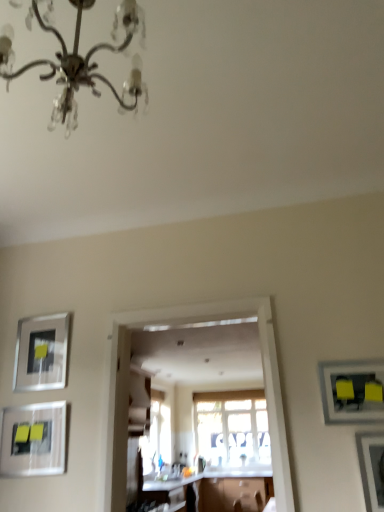
Question: Could you tell me if metallic silver picture frame at lower right, which is counted as the 4th picture frame, starting from the back, is facing transparent glass door at center?

Choices:
 (A) no
 (B) yes

Answer: (A)

Question: Considering the relative sizes of metallic silver picture frame at lower right, acting as the first picture frame starting from the front, and transparent glass door at center in the image provided, is metallic silver picture frame at lower right, acting as the first picture frame starting from the front, thinner than transparent glass door at center?

Choices:
 (A) no
 (B) yes

Answer: (B)

Question: Are metallic silver picture frame at lower right, which ranks as the 4th picture frame in left-to-right order, and transparent glass door at center located far from each other?

Choices:
 (A) yes
 (B) no

Answer: (B)

Question: Is metallic silver picture frame at lower right, acting as the first picture frame starting from the front, at the left side of transparent glass door at center?

Choices:
 (A) yes
 (B) no

Answer: (B)

Question: Is the depth of metallic silver picture frame at lower right, which ranks as the 4th picture frame in left-to-right order, greater than that of transparent glass door at center?

Choices:
 (A) no
 (B) yes

Answer: (A)

Question: Is metallic silver picture frame at lower right, which is counted as the 4th picture frame, starting from the back, bigger than transparent glass door at center?

Choices:
 (A) yes
 (B) no

Answer: (B)

Question: Considering the relative sizes of metallic silver picture frame at lower right, which ranks as the 4th picture frame in left-to-right order, and silver metallic picture frame at left, the first picture frame positioned from the left, in the image provided, is metallic silver picture frame at lower right, which ranks as the 4th picture frame in left-to-right order, smaller than silver metallic picture frame at left, the first picture frame positioned from the left,?

Choices:
 (A) yes
 (B) no

Answer: (A)

Question: Does metallic silver picture frame at lower right, which is counted as the 4th picture frame, starting from the back, turn towards silver metallic picture frame at left, acting as the fourth picture frame starting from the right?

Choices:
 (A) no
 (B) yes

Answer: (A)

Question: Considering the relative sizes of metallic silver picture frame at lower right, which ranks as the 4th picture frame in left-to-right order, and silver metallic picture frame at left, the first picture frame positioned from the left, in the image provided, is metallic silver picture frame at lower right, which ranks as the 4th picture frame in left-to-right order, shorter than silver metallic picture frame at left, the first picture frame positioned from the left,?

Choices:
 (A) no
 (B) yes

Answer: (B)

Question: Is metallic silver picture frame at lower right, acting as the first picture frame starting from the front, not close to silver metallic picture frame at left, the 1th picture frame viewed from the back?

Choices:
 (A) yes
 (B) no

Answer: (A)

Question: Is the position of metallic silver picture frame at lower right, acting as the first picture frame starting from the front, more distant than that of silver metallic picture frame at left, acting as the fourth picture frame starting from the right?

Choices:
 (A) yes
 (B) no

Answer: (B)

Question: Is metallic silver picture frame at lower right, acting as the first picture frame starting from the front, directly adjacent to silver metallic picture frame at left, the first picture frame positioned from the left?

Choices:
 (A) no
 (B) yes

Answer: (A)

Question: Are metallic silver picture frame at lower right, acting as the first picture frame starting from the front, and silver metallic chandelier at upper center far apart?

Choices:
 (A) no
 (B) yes

Answer: (B)